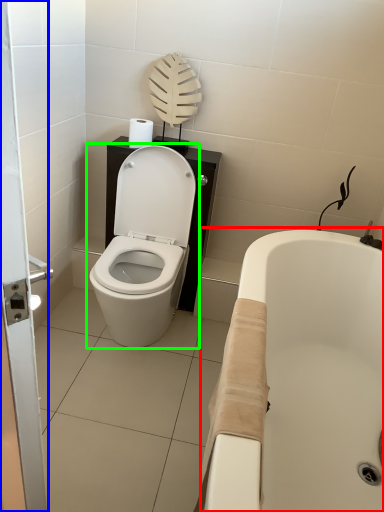
Question: Which object is the farthest from bath (highlighted by a red box)? Choose among these: screen door (highlighted by a blue box) or toilet (highlighted by a green box).

Choices:
 (A) screen door
 (B) toilet

Answer: (A)